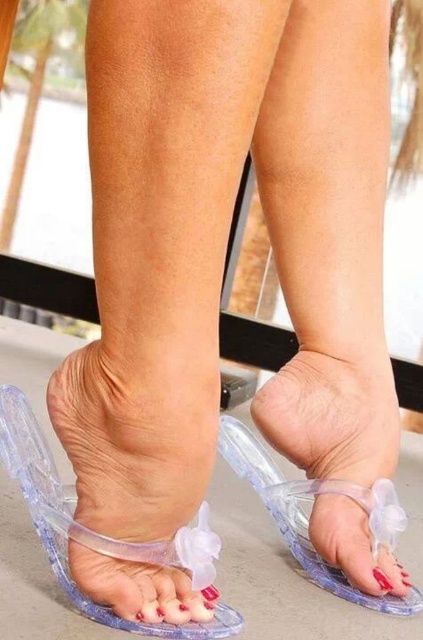
You are a photographer trying to capture the details of the transparent plastic flip flop at lower center. You notice a point marked at coordinates point [131,440]. Based on the scene description, where is this point located?

The point [131,440] is on the transparent plastic flip flop at lower center.